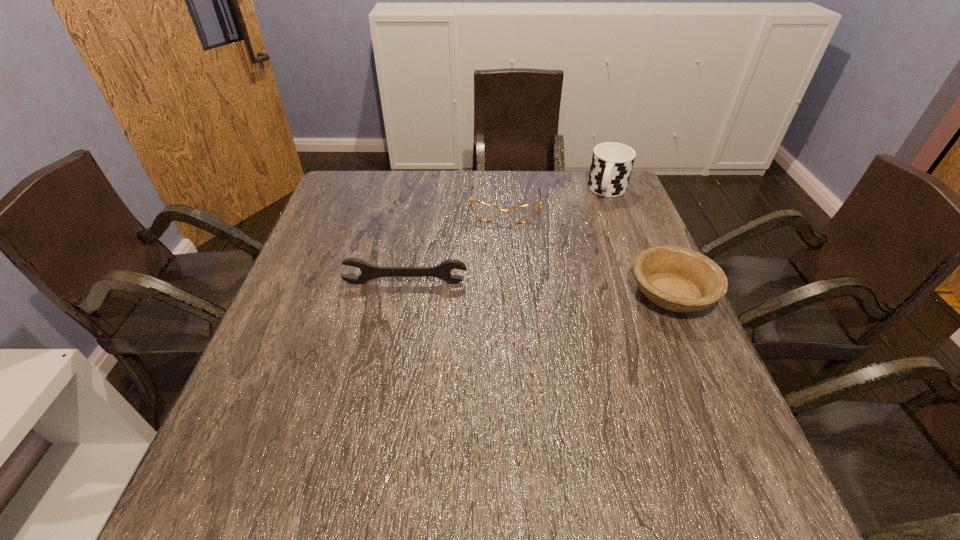
The width and height of the screenshot is (960, 540). Find the location of `wrench`. wrench is located at coordinates (368, 272).

Identify the location of bowl. coord(675,278).

Identify the location of spectacles. (486, 212).

The height and width of the screenshot is (540, 960). In order to click on the tallest object in this screenshot , I will do `click(612, 163)`.

This screenshot has height=540, width=960. In order to click on vacant area situated 0.080m on the open ends of the wrench in this screenshot , I will do [400, 308].

Identify the location of vacant space located on the left of the bowl. tap(523, 293).

This screenshot has width=960, height=540. What are the coordinates of `vacant region located on the front-facing side of the spectacles` in the screenshot? It's located at (498, 300).

This screenshot has width=960, height=540. I want to click on free location located on the front-facing side of the spectacles, so click(502, 248).

This screenshot has width=960, height=540. I want to click on free space located 0.390m on the front-facing side of the spectacles, so click(x=495, y=329).

The height and width of the screenshot is (540, 960). Find the location of `free spot located 0.360m on the side of the tallest object with the handle`. free spot located 0.360m on the side of the tallest object with the handle is located at coordinates (578, 279).